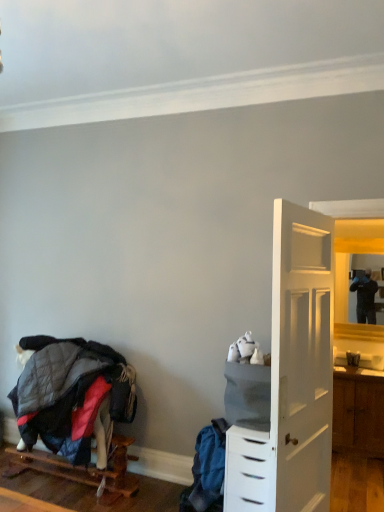
Question: Does quilted fabric bunk bed at lower left have a greater width compared to wooden pallet at lower left?

Choices:
 (A) yes
 (B) no

Answer: (B)

Question: Could you tell me if quilted fabric bunk bed at lower left is turned towards wooden pallet at lower left?

Choices:
 (A) yes
 (B) no

Answer: (B)

Question: From the image's perspective, would you say quilted fabric bunk bed at lower left is shown under wooden pallet at lower left?

Choices:
 (A) no
 (B) yes

Answer: (A)

Question: Considering the relative sizes of quilted fabric bunk bed at lower left and wooden pallet at lower left in the image provided, is quilted fabric bunk bed at lower left smaller than wooden pallet at lower left?

Choices:
 (A) no
 (B) yes

Answer: (A)

Question: Does quilted fabric bunk bed at lower left have a greater height compared to wooden pallet at lower left?

Choices:
 (A) yes
 (B) no

Answer: (A)

Question: Could wooden pallet at lower left be considered to be inside quilted fabric bunk bed at lower left?

Choices:
 (A) yes
 (B) no

Answer: (B)

Question: Considering the relative positions of white plastic chest of drawers at right and wooden pallet at lower left in the image provided, is white plastic chest of drawers at right to the right of wooden pallet at lower left from the viewer's perspective?

Choices:
 (A) no
 (B) yes

Answer: (B)

Question: Is white plastic chest of drawers at right placed right next to wooden pallet at lower left?

Choices:
 (A) yes
 (B) no

Answer: (B)

Question: From a real-world perspective, is white plastic chest of drawers at right beneath wooden pallet at lower left?

Choices:
 (A) no
 (B) yes

Answer: (A)

Question: Is white plastic chest of drawers at right to the left of wooden pallet at lower left from the viewer's perspective?

Choices:
 (A) yes
 (B) no

Answer: (B)

Question: Can you confirm if white plastic chest of drawers at right is shorter than wooden pallet at lower left?

Choices:
 (A) no
 (B) yes

Answer: (A)

Question: Is white plastic chest of drawers at right located outside wooden pallet at lower left?

Choices:
 (A) yes
 (B) no

Answer: (A)

Question: From the image's perspective, is quilted fabric bunk bed at lower left above matte wooden mirror at right?

Choices:
 (A) no
 (B) yes

Answer: (A)